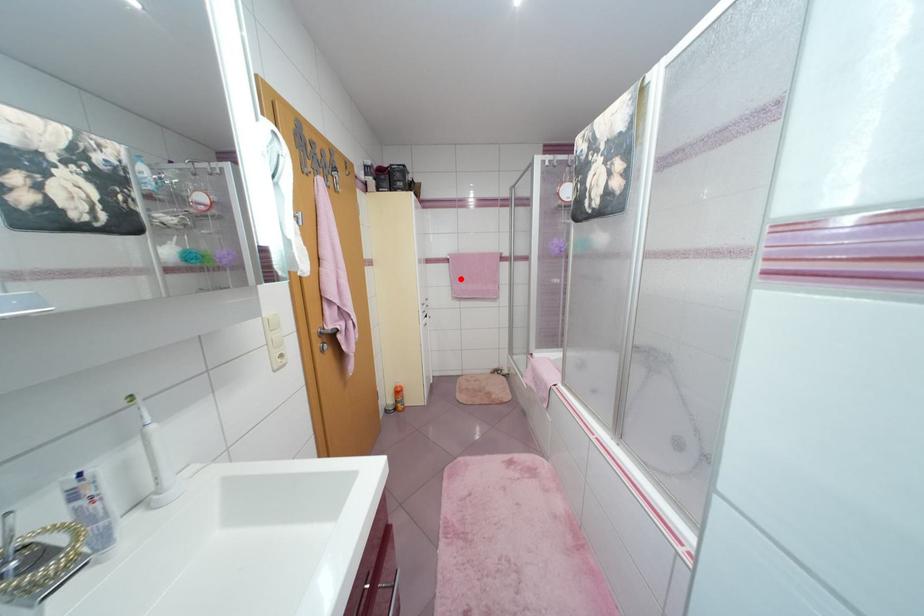
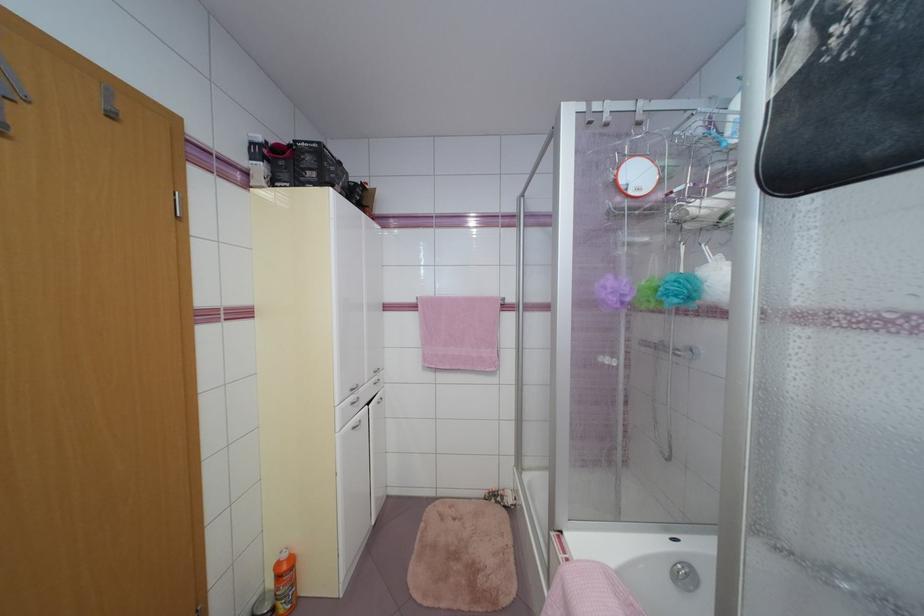
The point at the highlighted location is marked in the first image. Where is the corresponding point in the second image?

(433, 336)